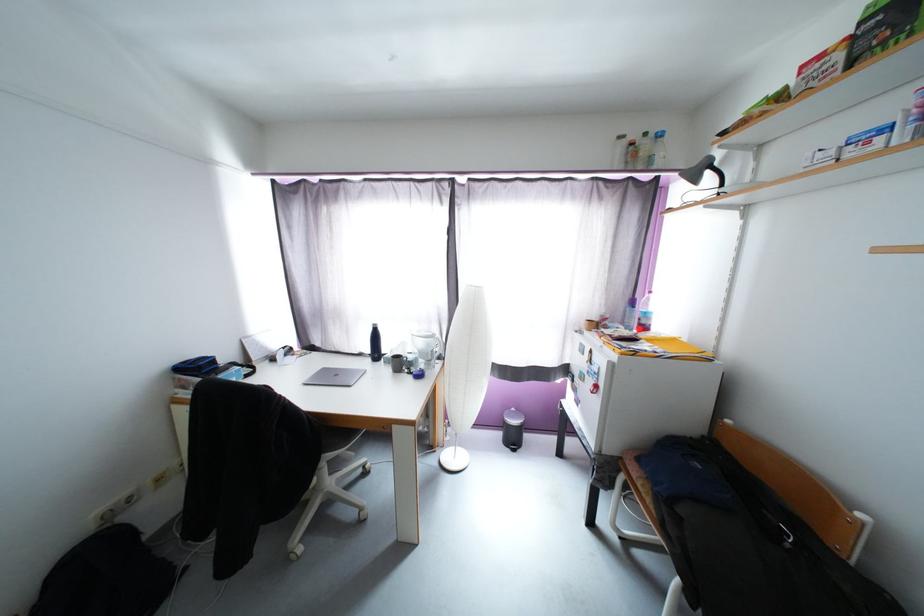
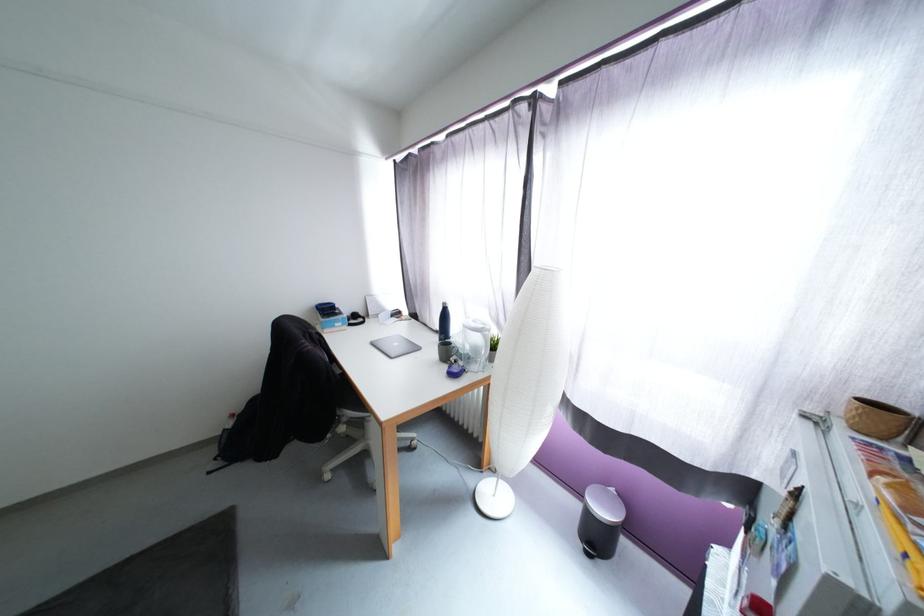
Question: The images are taken continuously from a first-person perspective. In which direction is your viewpoint rotating?

Choices:
 (A) Left
 (B) Right
 (C) Up
 (D) Down

Answer: (A)